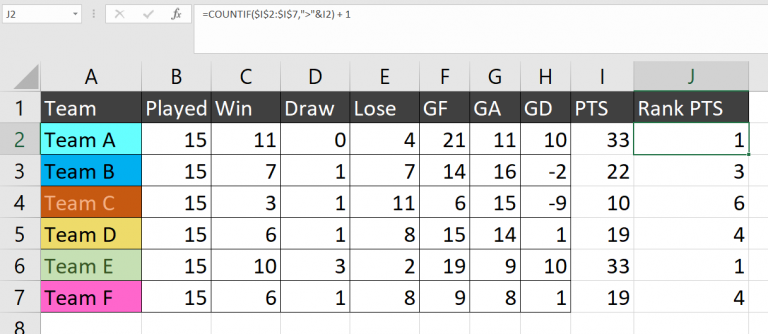
You are a GUI agent. You are given a task and a screenshot of the screen. Output one action in this format:
    pyautogui.click(x=<x>, y=<y>)
    Task: Click on the columns
    The width and height of the screenshot is (768, 334).
    Given the screenshot: What is the action you would take?
    pyautogui.click(x=94, y=80), pyautogui.click(x=176, y=76), pyautogui.click(x=253, y=78), pyautogui.click(x=323, y=76), pyautogui.click(x=386, y=74), pyautogui.click(x=437, y=77), pyautogui.click(x=495, y=74), pyautogui.click(x=548, y=72), pyautogui.click(x=603, y=73), pyautogui.click(x=697, y=71)